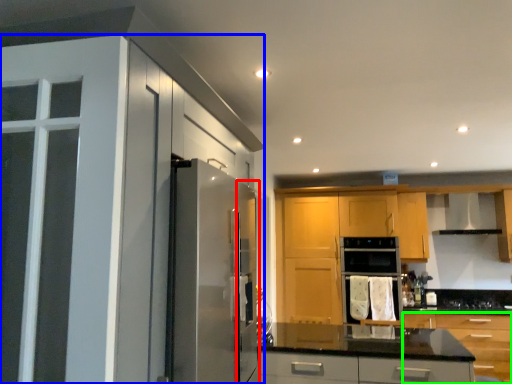
Question: Based on their relative distances, which object is farther from screen door (highlighted by a red box)? Choose from cabinetry (highlighted by a blue box) and cabinetry (highlighted by a green box).

Choices:
 (A) cabinetry
 (B) cabinetry

Answer: (B)